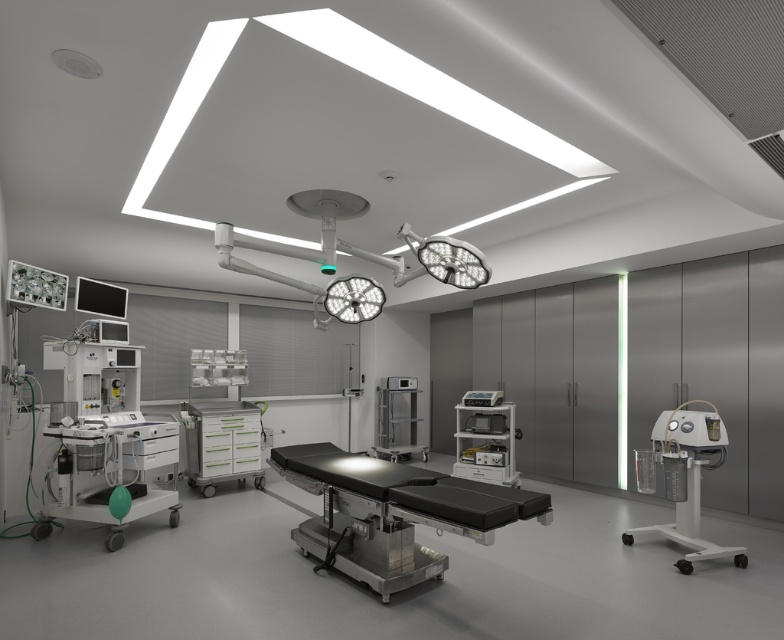
Who is higher up, white glossy medical cart at lower left or white plastic oxygen concentrator at right?

white plastic oxygen concentrator at right is above.

From the picture: Is white glossy medical cart at lower left below white plastic oxygen concentrator at right?

Yes, white glossy medical cart at lower left is below white plastic oxygen concentrator at right.

Who is more distant from viewer, (53,429) or (714,454)?

The point (53,429) is behind.

The image size is (784, 640). What are the coordinates of `white glossy medical cart at lower left` in the screenshot? It's located at (111, 470).

Which is above, white glossy medical cart at lower left or white glossy tool chest at center?

white glossy tool chest at center is higher up.

Does point (106, 516) come in front of point (184, 416)?

That is True.

Image resolution: width=784 pixels, height=640 pixels. I want to click on white glossy medical cart at lower left, so click(111, 470).

Between white glossy tool chest at center and satin silver medical cart at center, which one appears on the left side from the viewer's perspective?

white glossy tool chest at center is more to the left.

Does white glossy tool chest at center appear under satin silver medical cart at center?

No, white glossy tool chest at center is not below satin silver medical cart at center.

Between point (251, 410) and point (409, 384), which one is positioned behind?

Positioned behind is point (409, 384).

Where is `white glossy tool chest at center`? The width and height of the screenshot is (784, 640). white glossy tool chest at center is located at coordinates (220, 442).